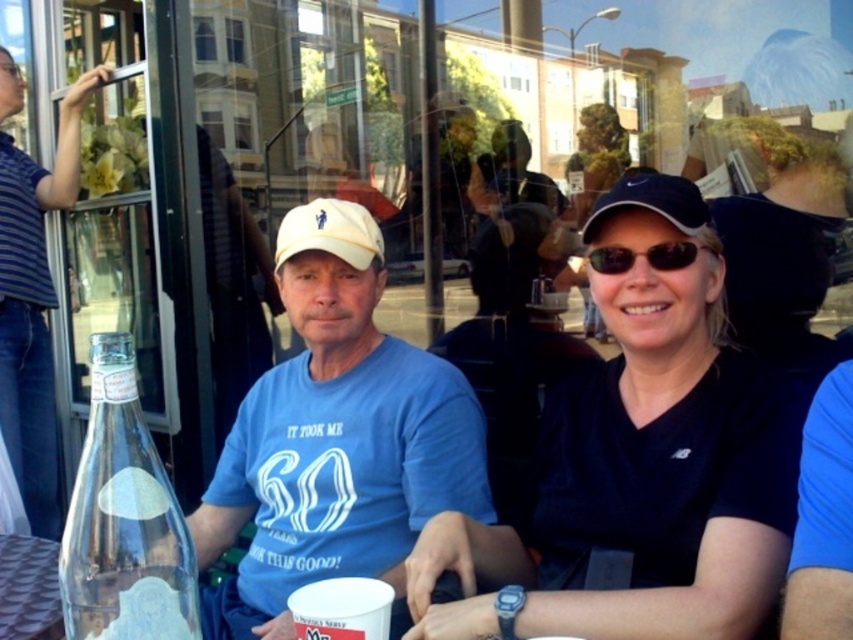
Question: Which object is the closest to the sunglasses at center?

Choices:
 (A) matte blue t-shirt at center
 (B) black matte baseball cap at upper right

Answer: (B)

Question: Which point is closer to the camera?

Choices:
 (A) white fabric baseball cap at center
 (B) clear glass bottle at left
 (C) matte blue t-shirt at center
 (D) blue striped shirt at left

Answer: (B)

Question: Is blue matte baseball cap at upper right in front of sunglasses at center?

Choices:
 (A) no
 (B) yes

Answer: (B)

Question: Can you confirm if clear glass bottle at left is wider than white fabric baseball cap at center?

Choices:
 (A) no
 (B) yes

Answer: (A)

Question: Which point appears farthest from the camera in this image?

Choices:
 (A) (119, 346)
 (B) (659, 212)
 (C) (367, 211)
 (D) (653, 573)

Answer: (C)

Question: Can you confirm if white fabric baseball cap at center is positioned above blue matte baseball cap at upper right?

Choices:
 (A) yes
 (B) no

Answer: (B)